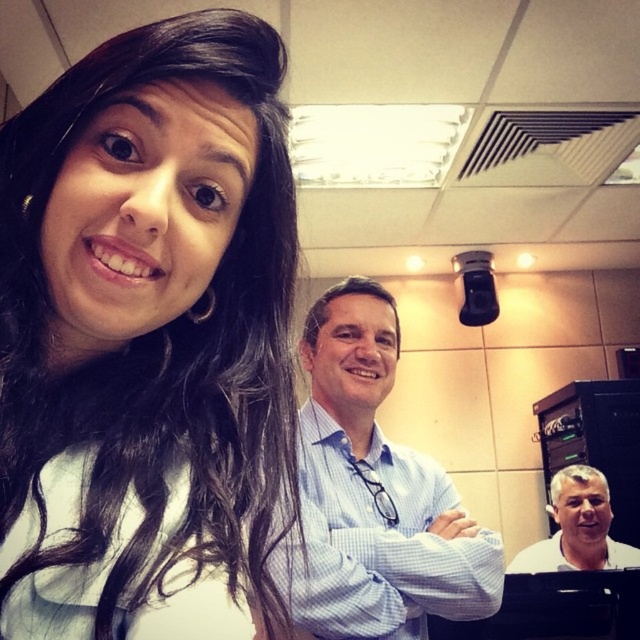
You are a GUI agent. You are given a task and a screenshot of the screen. Output one action in this format:
    pyautogui.click(x=<x>, y=<y>)
    Task: Click on the light blue checkered shirt at center
    This screenshot has width=640, height=640.
    Given the screenshot: What is the action you would take?
    point(384,540)

Is point (317, 429) closer to camera compared to point (636, 563)?

Yes, it is in front of point (636, 563).

The height and width of the screenshot is (640, 640). Identify the location of light blue checkered shirt at center. (384, 540).

Is point (186, 467) closer to viewer compared to point (477, 600)?

Yes, point (186, 467) is in front of point (477, 600).

In the scene shown: Is the position of matte white shirt at upper left more distant than that of light blue checkered shirt at center?

No.

Which is behind, point (93, 342) or point (317, 490)?

The point (317, 490) is more distant.

Locate an element on the screen. This screenshot has height=640, width=640. matte white shirt at upper left is located at coordinates (148, 339).

This screenshot has width=640, height=640. What do you see at coordinates (148, 339) in the screenshot? I see `matte white shirt at upper left` at bounding box center [148, 339].

The image size is (640, 640). What are the coordinates of `matte white shirt at upper left` in the screenshot? It's located at (148, 339).